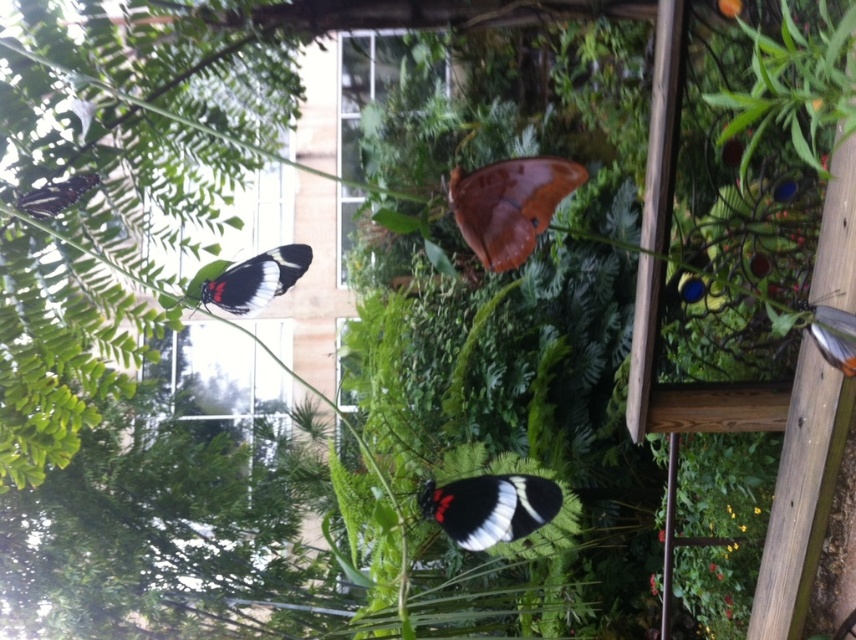
What do you see at coordinates (509, 204) in the screenshot? I see `brown matte butterfly at upper center` at bounding box center [509, 204].

Is brown matte butterfly at upper center to the right of matte black butterfly at upper left from the viewer's perspective?

Yes, brown matte butterfly at upper center is to the right of matte black butterfly at upper left.

You are a GUI agent. You are given a task and a screenshot of the screen. Output one action in this format:
    pyautogui.click(x=<x>, y=<y>)
    Task: Click on the brown matte butterfly at upper center
    This screenshot has width=856, height=640.
    Given the screenshot: What is the action you would take?
    pyautogui.click(x=509, y=204)

Who is positioned more to the left, black matte butterfly at upper left or matte black butterfly at upper left?

From the viewer's perspective, matte black butterfly at upper left appears more on the left side.

Where is `black matte butterfly at upper left`? black matte butterfly at upper left is located at coordinates (253, 280).

Which is in front, point (294, 257) or point (813, 337)?

Point (813, 337)

The image size is (856, 640). What do you see at coordinates (253, 280) in the screenshot?
I see `black matte butterfly at upper left` at bounding box center [253, 280].

The image size is (856, 640). Describe the element at coordinates (253, 280) in the screenshot. I see `black matte butterfly at upper left` at that location.

This screenshot has width=856, height=640. What are the coordinates of `black matte butterfly at upper left` in the screenshot? It's located at (253, 280).